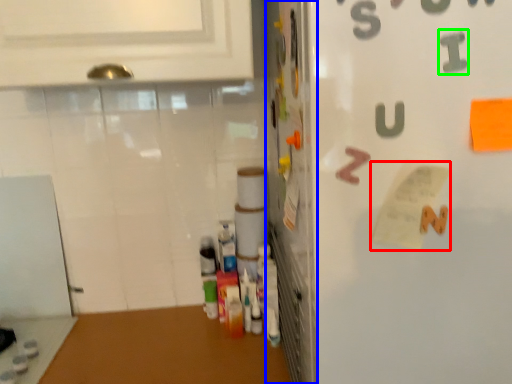
Question: Based on their relative distances, which object is nearer to paper (highlighted by a red box)? Choose from door (highlighted by a blue box) and alphabet (highlighted by a green box).

Choices:
 (A) door
 (B) alphabet

Answer: (B)